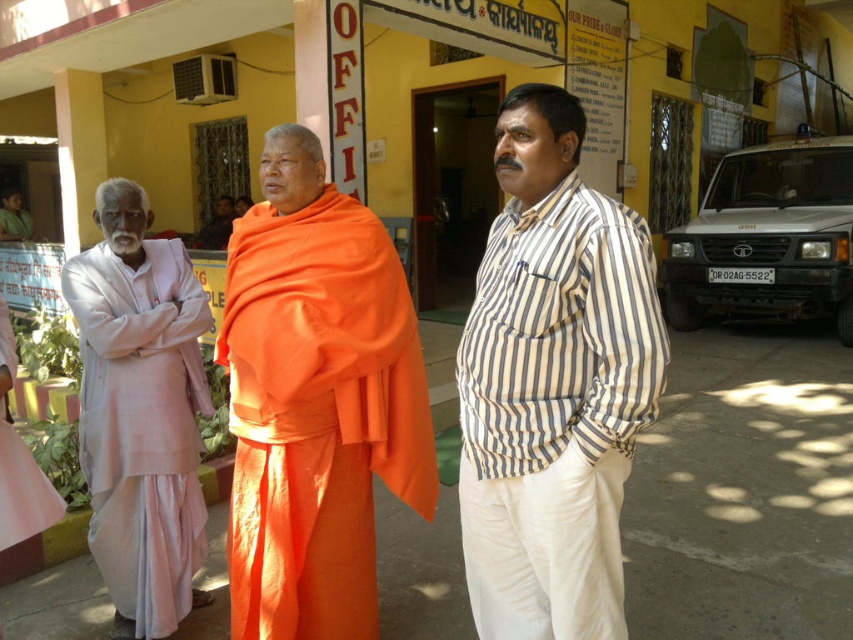
Does striped cotton shirt at center appear under orange cloth at center?

Actually, striped cotton shirt at center is above orange cloth at center.

Is striped cotton shirt at center smaller than orange cloth at center?

Yes, striped cotton shirt at center is smaller than orange cloth at center.

Identify the location of striped cotton shirt at center. The image size is (853, 640). (555, 412).

Where is `striped cotton shirt at center`? striped cotton shirt at center is located at coordinates (555, 412).

Does striped cotton shirt at center have a smaller size compared to light pink cotton kurta at left?

Actually, striped cotton shirt at center might be larger than light pink cotton kurta at left.

Which is in front, point (486, 358) or point (111, 384)?

Positioned in front is point (486, 358).

Does point (473, 339) lie in front of point (171, 406)?

That is True.

Locate an element on the screen. striped cotton shirt at center is located at coordinates (555, 412).

Can you confirm if orange cloth at center is thinner than light pink cotton kurta at left?

In fact, orange cloth at center might be wider than light pink cotton kurta at left.

In the scene shown: Between orange cloth at center and light pink cotton kurta at left, which one appears on the left side from the viewer's perspective?

From the viewer's perspective, light pink cotton kurta at left appears more on the left side.

Identify the location of orange cloth at center. This screenshot has width=853, height=640. (317, 413).

I want to click on orange cloth at center, so pos(317,413).